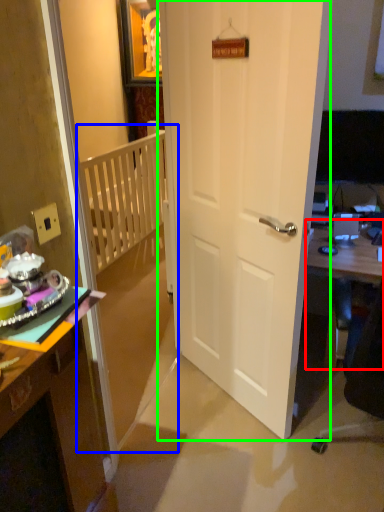
Question: Which object is positioned farthest from table (highlighted by a red box)? Select from bunk bed (highlighted by a blue box) and door (highlighted by a green box).

Choices:
 (A) bunk bed
 (B) door

Answer: (A)